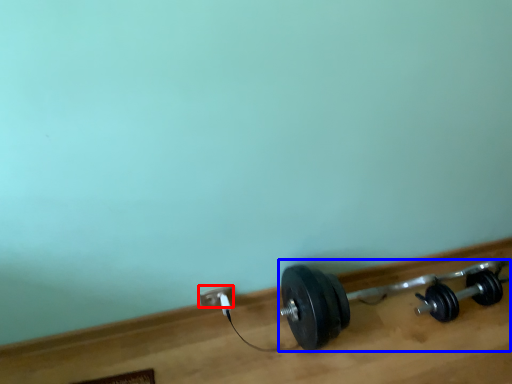
Question: Which point is further to the camera, power plugs and sockets (highlighted by a red box) or dumbbell (highlighted by a blue box)?

Choices:
 (A) power plugs and sockets
 (B) dumbbell

Answer: (A)